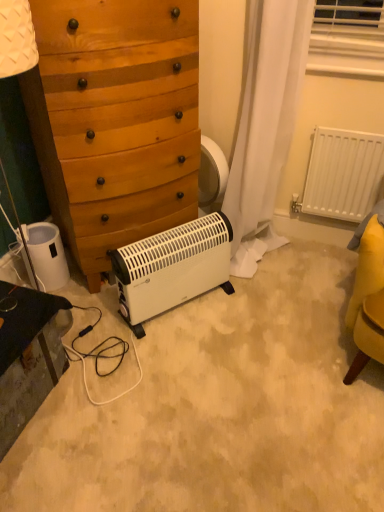
In order to click on free location to the right of white matte heater at center in this screenshot , I will do `click(257, 329)`.